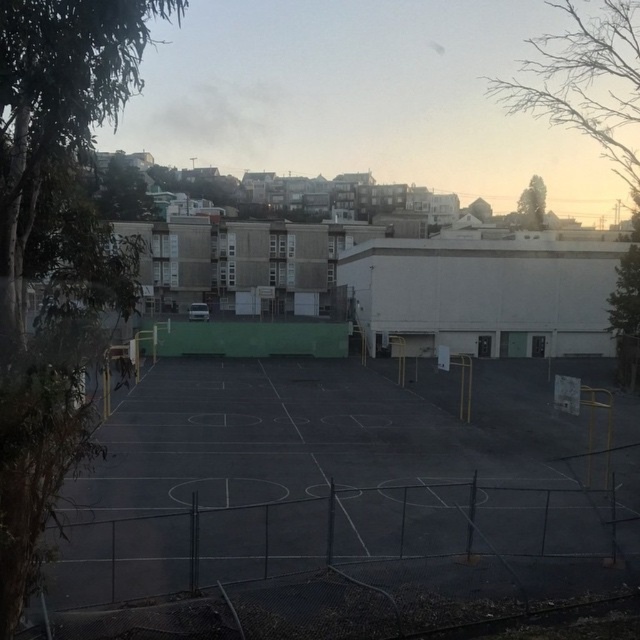
You are standing at the center of the basketball court and see two points marked on the court. The first point is at coordinates point (x=88, y=220) and the second point is at point (x=604, y=106). Which point is closer to you?

Point (x=88, y=220) is closer to the camera than point (x=604, y=106), so the first point is closer to you.

You are standing on the basketball court and want to throw a ball to your friend who is standing near the green leafy tree at upper right. Which tree should you aim for if you want to avoid hitting the green leafy tree at left?

You should aim for the green leafy tree at upper right and avoid the green leafy tree at left, which is positioned on its left side.

You are standing on the basketball court and want to know which tree is taller. Can you determine which one is taller between the green leafy tree at left and the green leafy tree at upper right?

The green leafy tree at upper right is taller than the green leafy tree at left.